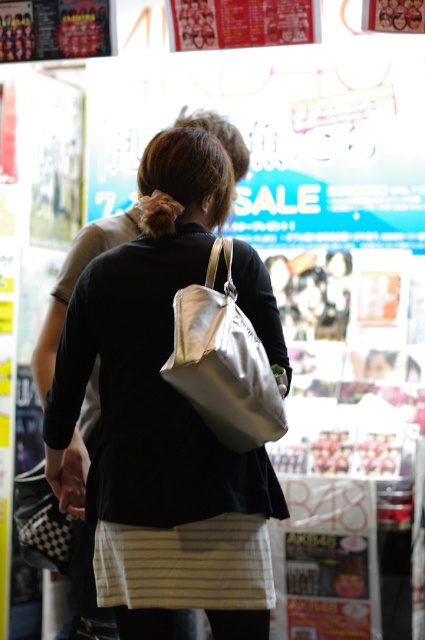
You are a customer in the store and want to pick up the white fabric bag at center and the white fabric shoulder bag at center. Which one is closer to you?

The white fabric bag at center is closer to you since it is further to the viewer than the white fabric shoulder bag at center.

You are a customer in the store and you want to know which item is smaller between the white striped apron at lower center and the white fabric shoulder bag at center. Can you determine this?

The white striped apron at lower center is smaller than the white fabric shoulder bag at center.